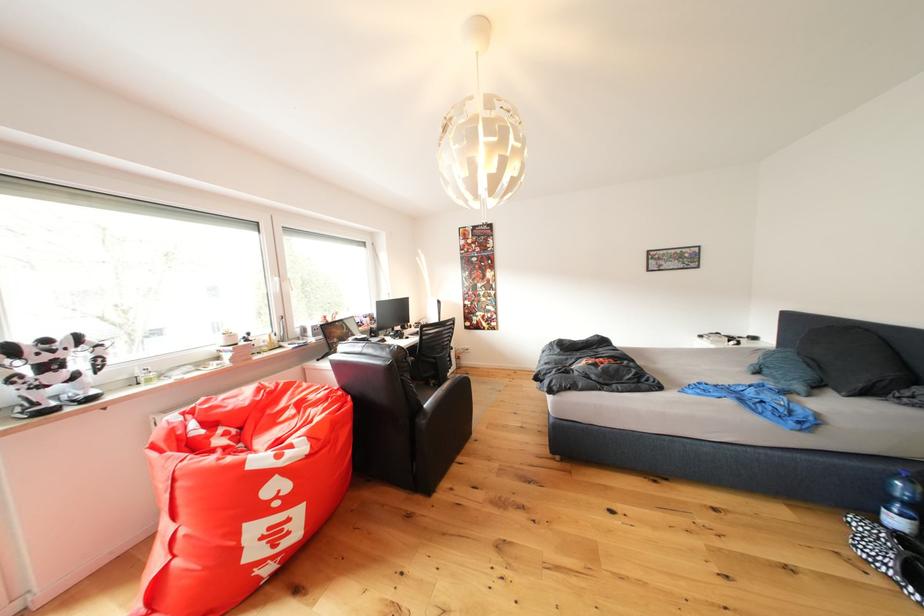
You are a GUI agent. You are given a task and a screenshot of the screen. Output one action in this format:
    pyautogui.click(x=<x>, y=<y>)
    Task: Click on the white window handle
    Image resolution: width=924 pixels, height=616 pixels.
    Given the screenshot: What is the action you would take?
    pyautogui.click(x=275, y=285)